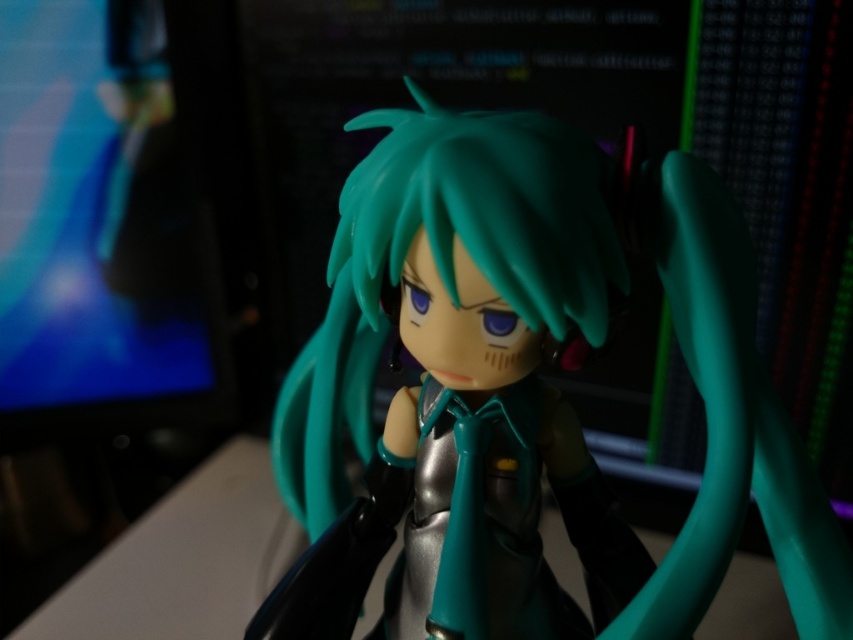
Question: Is matte black monitor at left to the left of teal glossy hair at center from the viewer's perspective?

Choices:
 (A) yes
 (B) no

Answer: (A)

Question: Which of the following is the closest to the observer?

Choices:
 (A) (587, 147)
 (B) (103, 284)

Answer: (A)

Question: Is matte black monitor at left bigger than teal glossy hair at center?

Choices:
 (A) yes
 (B) no

Answer: (A)

Question: Among these objects, which one is nearest to the camera?

Choices:
 (A) teal glossy hair at center
 (B) matte black monitor at left

Answer: (A)

Question: Can you confirm if matte black monitor at left is smaller than teal glossy hair at center?

Choices:
 (A) no
 (B) yes

Answer: (A)